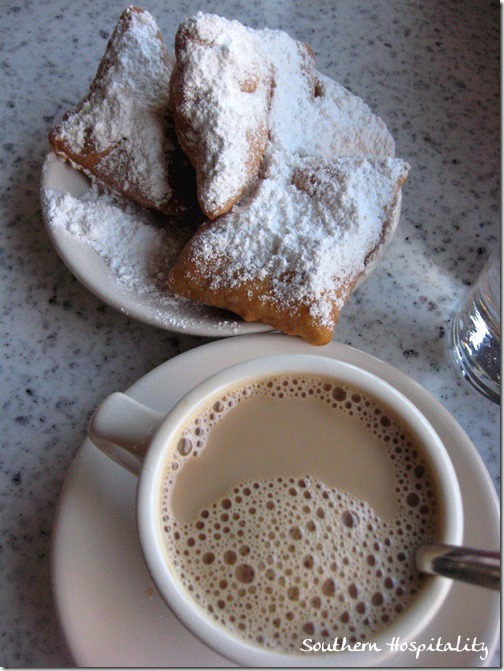
The image size is (504, 671). Find the location of `counter`. counter is located at coordinates (56, 378).